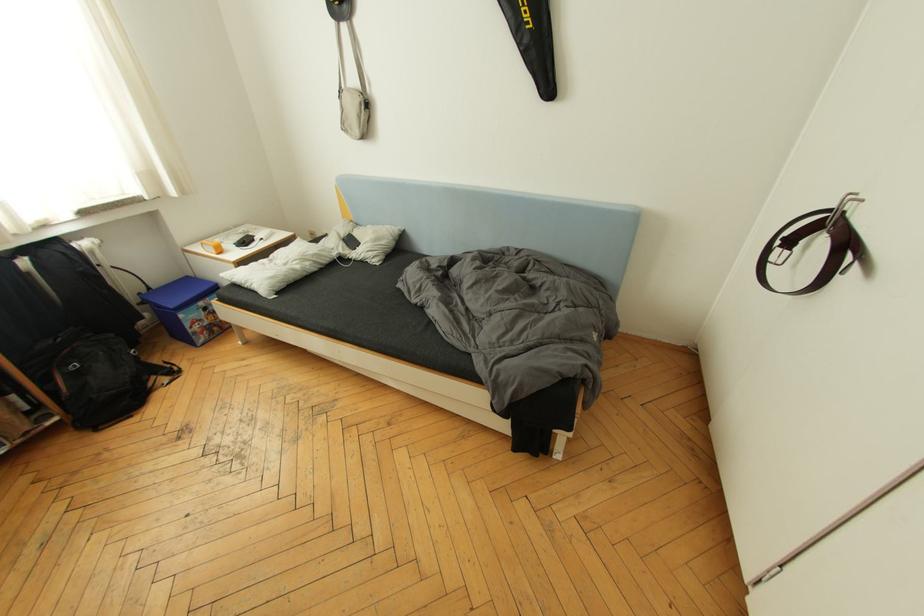
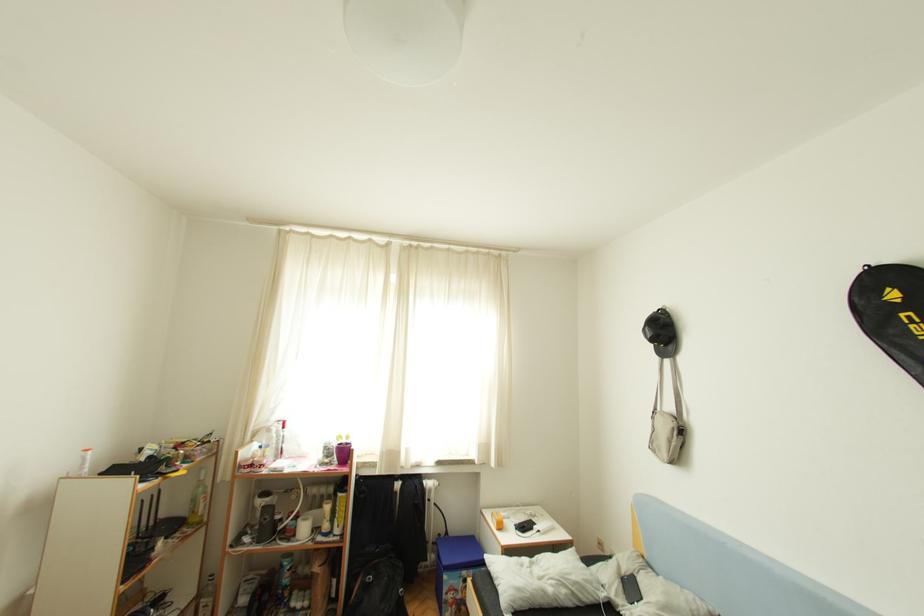
First-person continuous shooting, in which direction is the camera rotating?

The rotation direction of the camera is left-up.